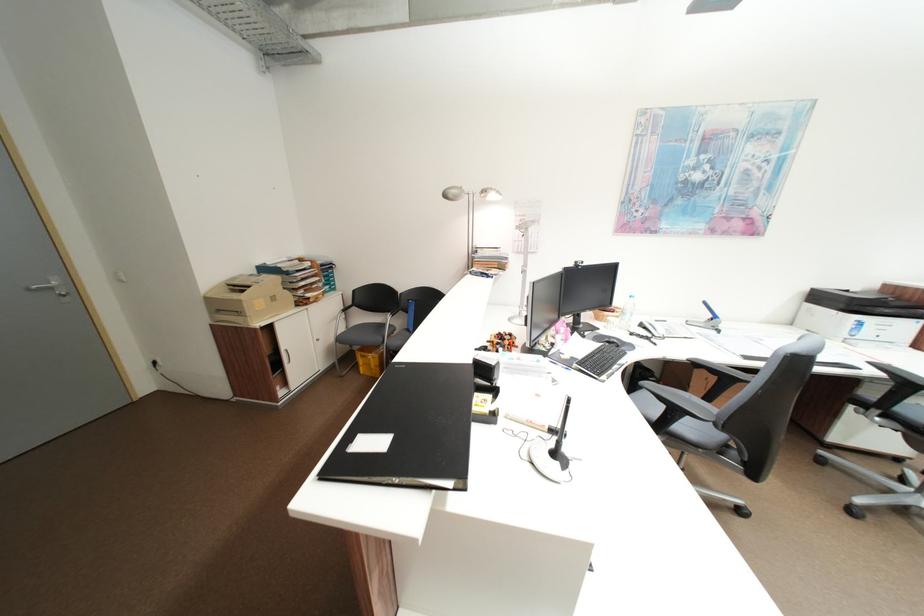
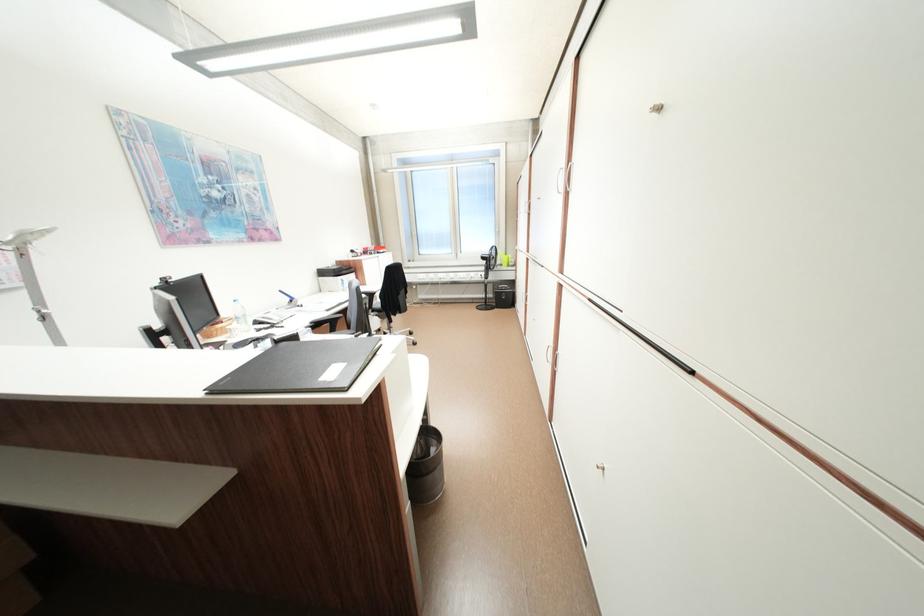
The point at (615, 321) is marked in the first image. Where is the corresponding point in the second image?

(235, 331)